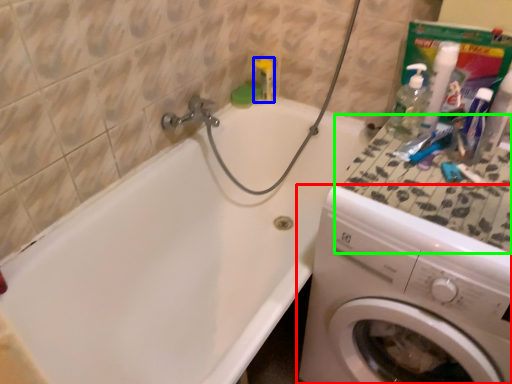
Question: Which is farther away from washing machine (highlighted by a red box)? toiletry (highlighted by a blue box) or counter top (highlighted by a green box)?

Choices:
 (A) toiletry
 (B) counter top

Answer: (A)